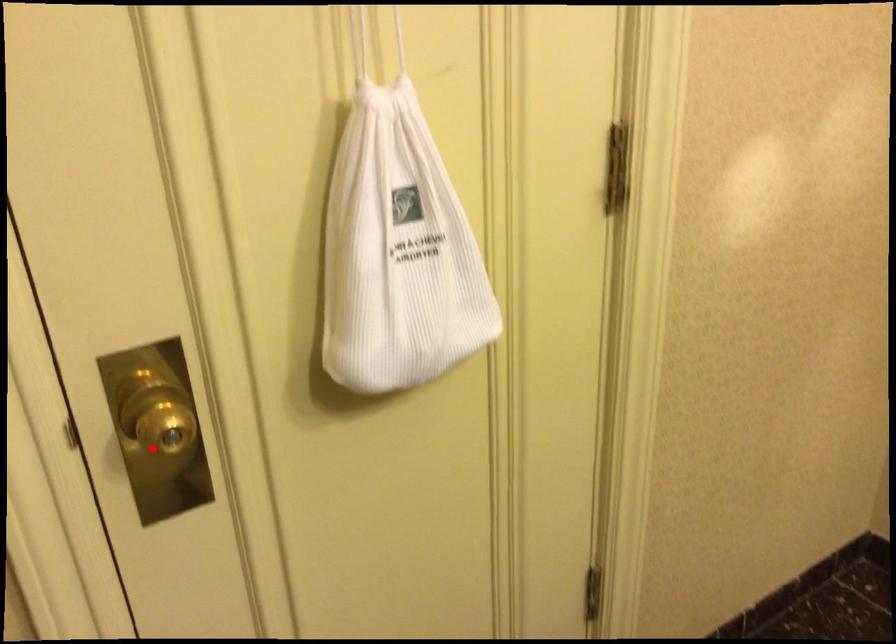
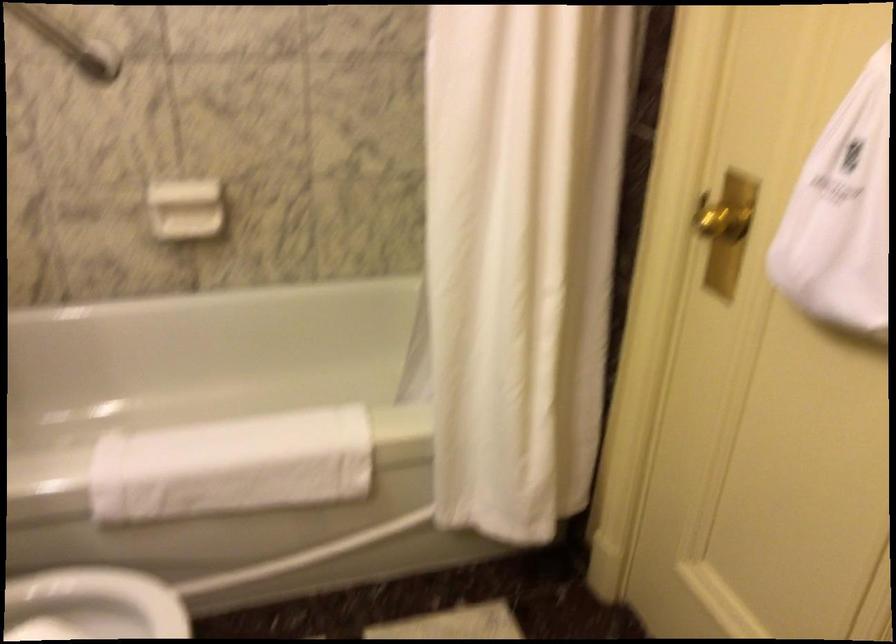
In the second image, find the point that corresponds to the highlighted location in the first image.

(722, 222)